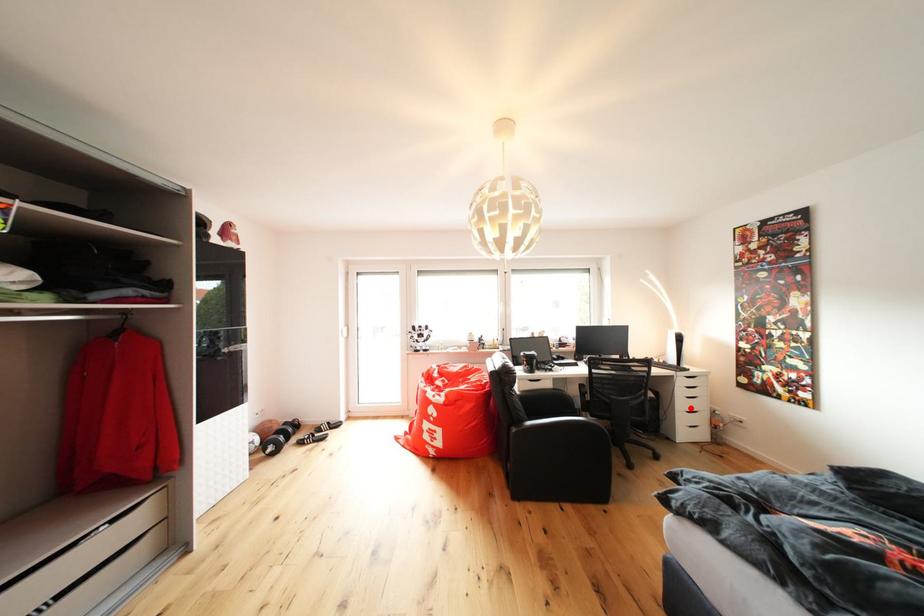
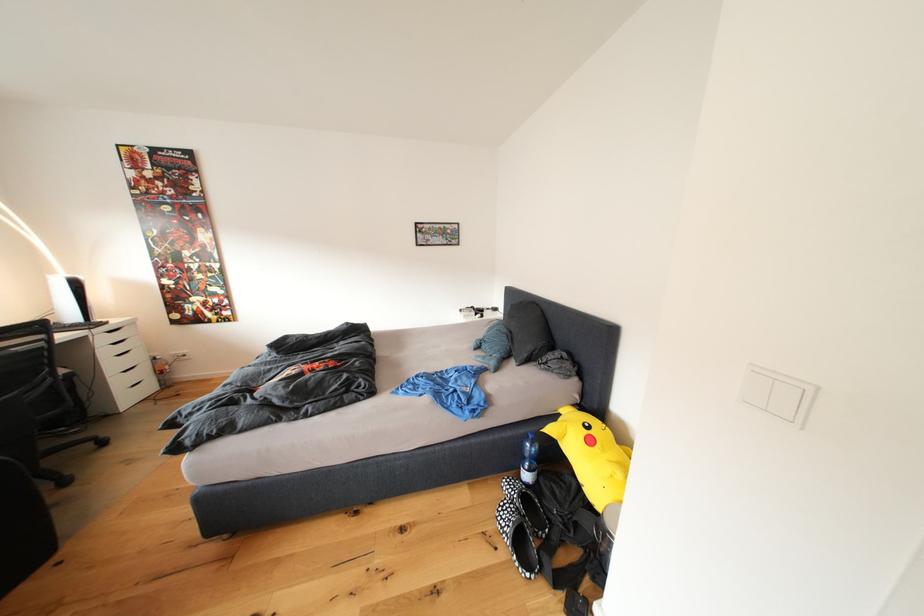
Question: I am providing you with two images of the same scene from different viewpoints. In image1, a red point is highlighted. Considering the same 3D point in image2, which of the following is correct?

Choices:
 (A) It is closer
 (B) It is farther

Answer: (B)